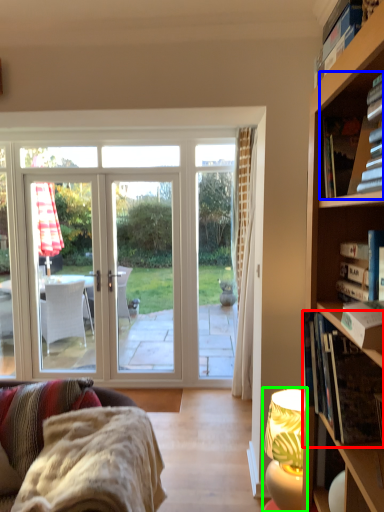
Question: Which object is the closest to the book (highlighted by a red box)? Choose among these: book (highlighted by a blue box) or lamp (highlighted by a green box).

Choices:
 (A) book
 (B) lamp

Answer: (B)